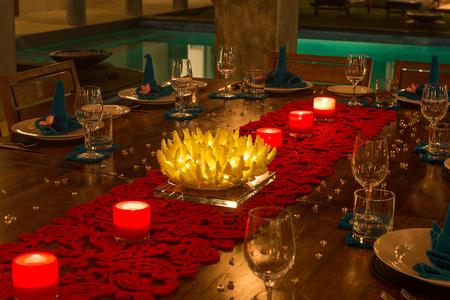
The width and height of the screenshot is (450, 300). Find the location of `decorations`. decorations is located at coordinates (334, 186), (327, 191), (145, 154), (53, 181).